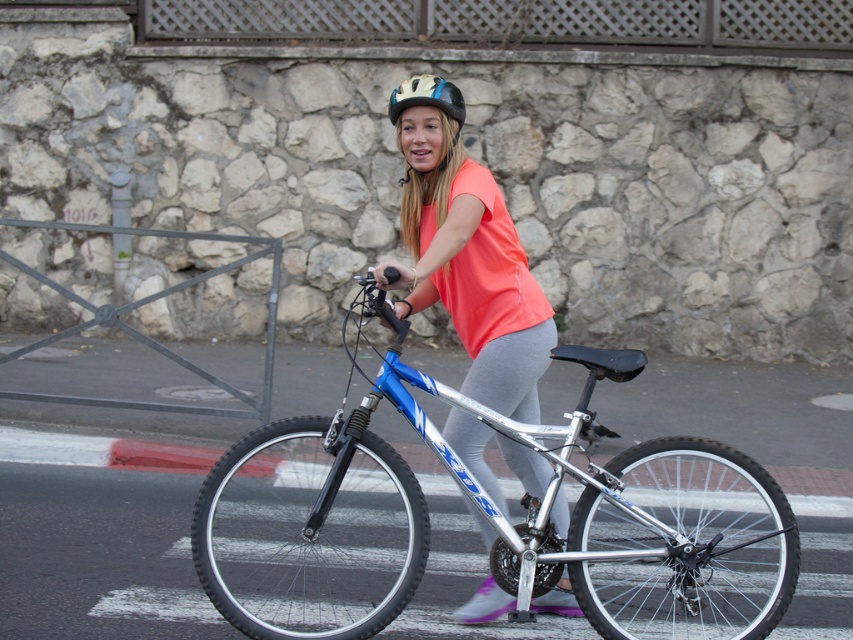
Which of these two, silver metallic bicycle at center or matte orange shirt at center, stands shorter?

silver metallic bicycle at center

I want to click on silver metallic bicycle at center, so click(x=492, y=525).

Identify the location of silver metallic bicycle at center. (492, 525).

This screenshot has height=640, width=853. Describe the element at coordinates (492, 525) in the screenshot. I see `silver metallic bicycle at center` at that location.

Does silver metallic bicycle at center have a smaller size compared to matte yellow helmet at center?

Incorrect, silver metallic bicycle at center is not smaller in size than matte yellow helmet at center.

What do you see at coordinates (492, 525) in the screenshot? I see `silver metallic bicycle at center` at bounding box center [492, 525].

The height and width of the screenshot is (640, 853). I want to click on silver metallic bicycle at center, so click(x=492, y=525).

Is matte orange shirt at center shorter than matte yellow helmet at center?

No.

The image size is (853, 640). Find the location of `matte orange shirt at center`. matte orange shirt at center is located at coordinates (466, 252).